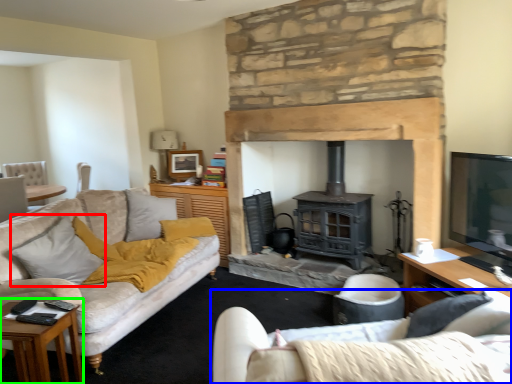
Question: Estimate the real-world distances between objects in this image. Which object is closer to pillow (highlighted by a red box), studio couch (highlighted by a blue box) or table (highlighted by a green box)?

Choices:
 (A) studio couch
 (B) table

Answer: (B)